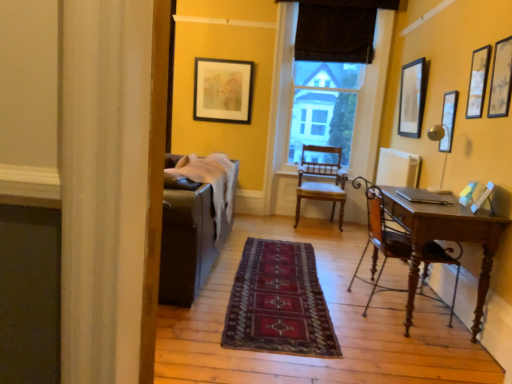
Question: Is matte wooden picture frame at upper right, the fifth picture frame when ordered from back to front, not inside wooden chair at right, the 1th chair when ordered from front to back?

Choices:
 (A) no
 (B) yes

Answer: (B)

Question: From the image's perspective, does matte wooden picture frame at upper right, the first picture frame in the front-to-back sequence, appear lower than wooden chair at right, the 1th chair when ordered from front to back?

Choices:
 (A) yes
 (B) no

Answer: (B)

Question: Would you consider matte wooden picture frame at upper right, the fifth picture frame when ordered from back to front, to be distant from wooden chair at right, marked as the 2th chair in a back-to-front arrangement?

Choices:
 (A) no
 (B) yes

Answer: (B)

Question: Is matte wooden picture frame at upper right, the first picture frame in the front-to-back sequence, shorter than wooden chair at right, the 1th chair when ordered from front to back?

Choices:
 (A) yes
 (B) no

Answer: (A)

Question: Does matte wooden picture frame at upper right, placed as the second picture frame when sorted from left to right, have a greater height compared to wooden chair at right, marked as the 2th chair in a back-to-front arrangement?

Choices:
 (A) no
 (B) yes

Answer: (A)

Question: Considering the positions of dark brown fabric at center and matte wooden picture frame at upper right, placed as the second picture frame when sorted from left to right, in the image, is dark brown fabric at center bigger or smaller than matte wooden picture frame at upper right, placed as the second picture frame when sorted from left to right,?

Choices:
 (A) big
 (B) small

Answer: (A)

Question: Considering the positions of dark brown fabric at center and matte wooden picture frame at upper right, which is the fourth picture frame from right to left, in the image, is dark brown fabric at center taller or shorter than matte wooden picture frame at upper right, which is the fourth picture frame from right to left,?

Choices:
 (A) tall
 (B) short

Answer: (A)

Question: Relative to matte wooden picture frame at upper right, the first picture frame in the front-to-back sequence, is dark brown fabric at center in front or behind?

Choices:
 (A) behind
 (B) front

Answer: (A)

Question: Is dark brown fabric at center to the left or to the right of matte wooden picture frame at upper right, placed as the second picture frame when sorted from left to right, in the image?

Choices:
 (A) right
 (B) left

Answer: (B)

Question: Visually, is matte wooden picture frame at upper right, which is the fourth picture frame from right to left, positioned to the left or to the right of wooden chair at center, the second chair when ordered from front to back?

Choices:
 (A) left
 (B) right

Answer: (B)

Question: Considering the positions of point (497, 48) and point (337, 188), is point (497, 48) closer or farther from the camera than point (337, 188)?

Choices:
 (A) farther
 (B) closer

Answer: (B)

Question: From the image's perspective, is matte wooden picture frame at upper right, placed as the second picture frame when sorted from left to right, above or below wooden chair at center, the second chair when ordered from front to back?

Choices:
 (A) below
 (B) above

Answer: (B)

Question: Is matte wooden picture frame at upper right, the fifth picture frame when ordered from back to front, in front of or behind wooden chair at center, the 1th chair from the back, in the image?

Choices:
 (A) behind
 (B) front

Answer: (B)

Question: Looking at the image, does wooden chair at right, the 1th chair when ordered from front to back, seem bigger or smaller compared to dark brown fabric at center?

Choices:
 (A) big
 (B) small

Answer: (A)

Question: Considering the positions of wooden chair at right, marked as the 2th chair in a back-to-front arrangement, and dark brown fabric at center in the image, is wooden chair at right, marked as the 2th chair in a back-to-front arrangement, wider or thinner than dark brown fabric at center?

Choices:
 (A) thin
 (B) wide

Answer: (B)